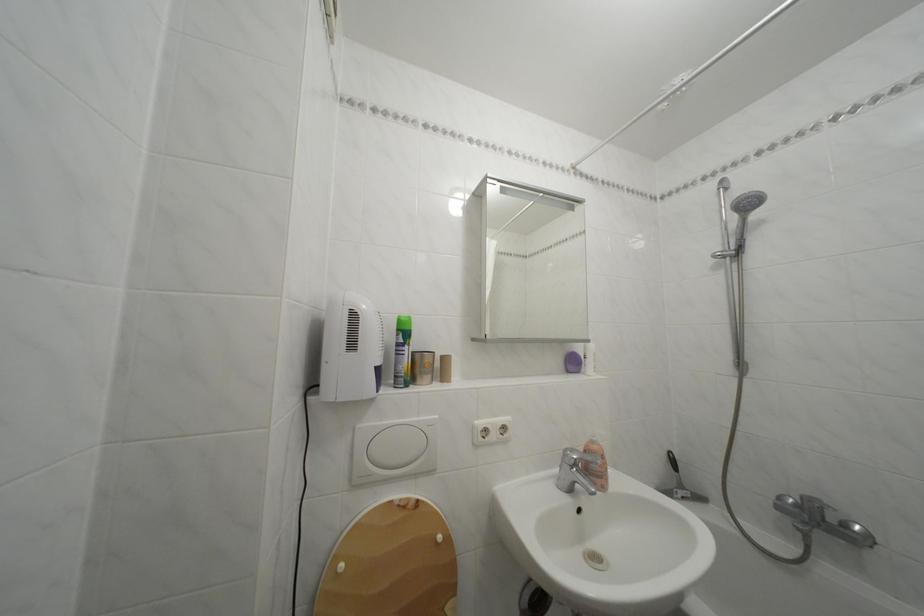
Where would you lift the black squeegee handle? Please return your answer as a coordinate pair (x, y).

(684, 475)